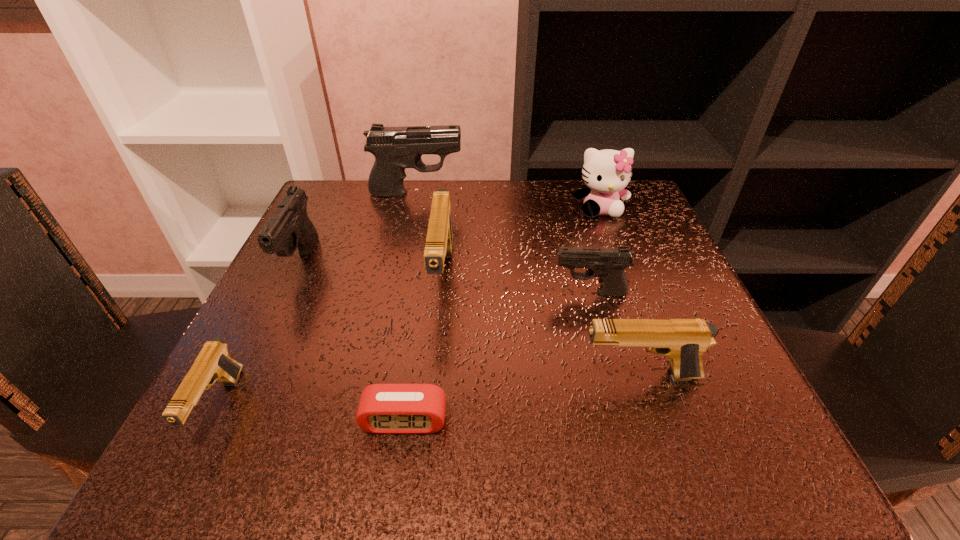
Locate an element on the screen. The image size is (960, 540). vacant position located at the barrel of the rightmost black pistol is located at coordinates (515, 293).

Image resolution: width=960 pixels, height=540 pixels. I want to click on free region located at the barrel of the rightmost black pistol, so click(437, 293).

In order to click on blank area located 0.100m at the barrel of the rightmost black pistol in this screenshot , I will do `click(497, 293)`.

Locate an element on the screen. The image size is (960, 540). kitten present at the far edge is located at coordinates (607, 172).

Find the location of `pistol that is at the near edge`. pistol that is at the near edge is located at coordinates (213, 363).

I want to click on alarm clock situated at the near edge, so click(383, 408).

Identify the location of kitten present at the right edge. The height and width of the screenshot is (540, 960). (607, 172).

You are a GUI agent. You are given a task and a screenshot of the screen. Output one action in this format:
    pyautogui.click(x=<x>, y=<y>)
    Task: Click on the object that is at the near left corner
    This screenshot has width=960, height=540.
    Given the screenshot: What is the action you would take?
    pyautogui.click(x=213, y=363)

The image size is (960, 540). I want to click on object present at the far right corner, so click(607, 172).

You are a GUI agent. You are given a task and a screenshot of the screen. Output one action in this format:
    pyautogui.click(x=<x>, y=<y>)
    Task: Click on the vacant region at the far edge of the desktop
    This screenshot has width=960, height=540.
    Given the screenshot: What is the action you would take?
    pyautogui.click(x=560, y=183)